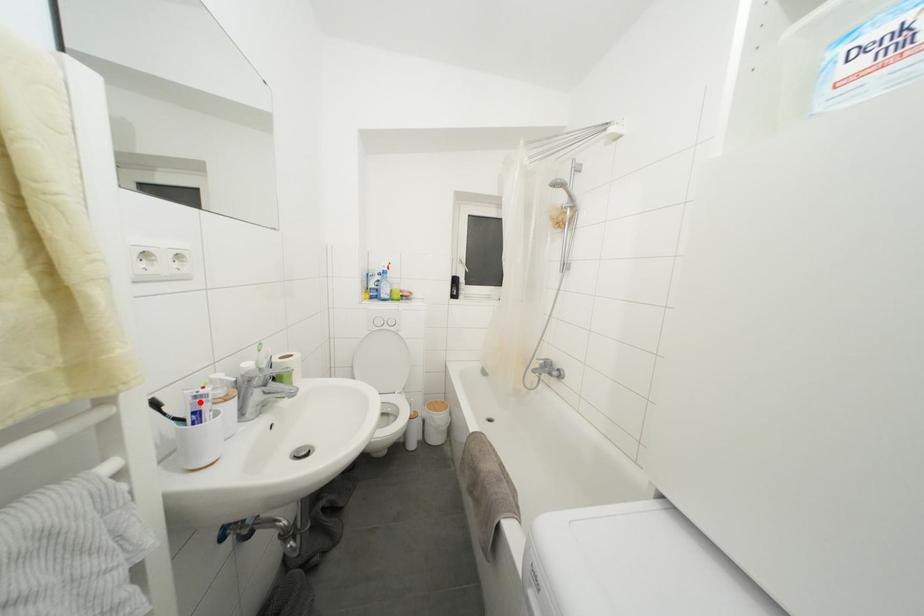
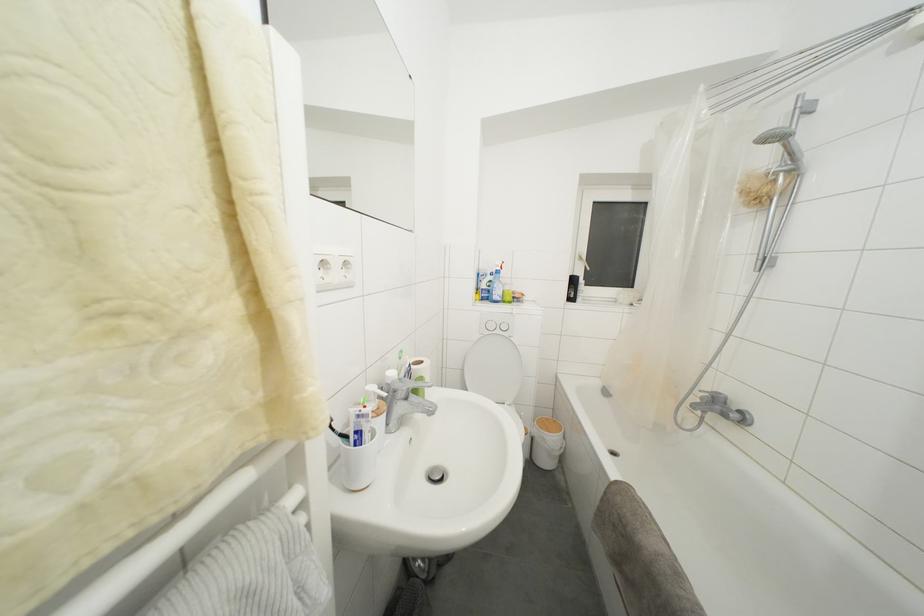
Where in the second image is the point corresponding to the highlighted location from the first image?

(362, 421)